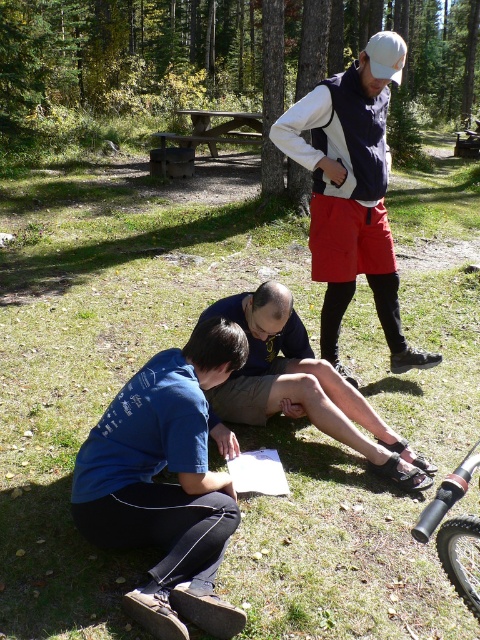
Question: Is black matte mountain bike at lower right smaller than wooden picnic table at center?

Choices:
 (A) no
 (B) yes

Answer: (B)

Question: Which object is positioned farthest from the black matte mountain bike at lower right?

Choices:
 (A) wooden picnic table at center
 (B) blue fabric shirt at lower center

Answer: (A)

Question: Among these objects, which one is nearest to the camera?

Choices:
 (A) blue fabric shirt at lower center
 (B) matte black vest at upper center
 (C) wooden picnic table at center
 (D) black matte mountain bike at lower right

Answer: (D)

Question: Does black matte mountain bike at lower right appear on the right side of wooden picnic table at center?

Choices:
 (A) yes
 (B) no

Answer: (A)

Question: Can you confirm if matte black vest at upper center is positioned above black matte mountain bike at lower right?

Choices:
 (A) yes
 (B) no

Answer: (A)

Question: Which point is farther from the camera taking this photo?

Choices:
 (A) (280, 400)
 (B) (253, 132)
 (C) (317, 106)
 (D) (469, 609)

Answer: (B)